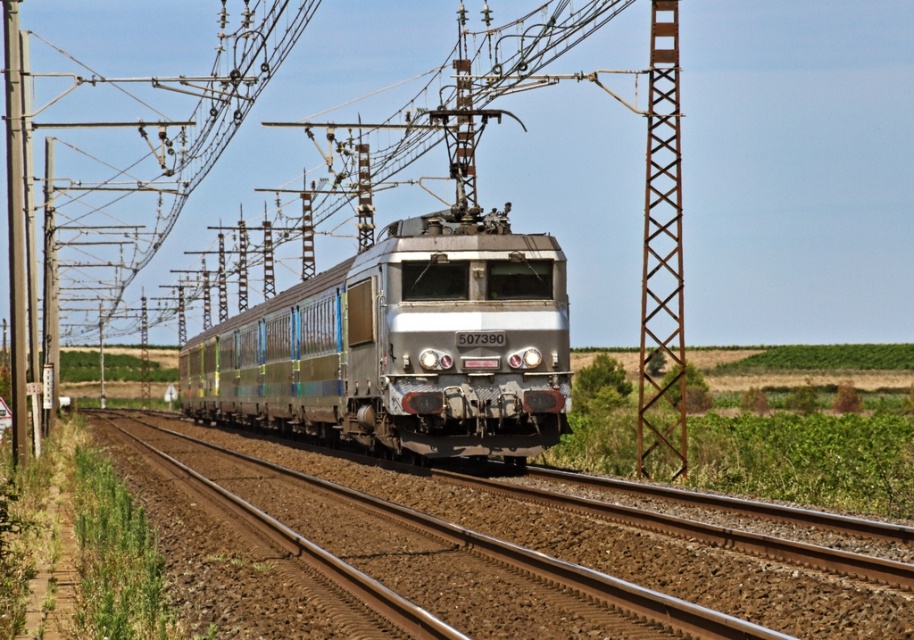
Question: Among these objects, which one is farthest from the camera?

Choices:
 (A) silver metallic train at center
 (B) rusty metal tower at center-right

Answer: (B)

Question: Does silver metallic train at center have a larger size compared to rusty metal tower at center-right?

Choices:
 (A) no
 (B) yes

Answer: (A)

Question: In this image, where is silver metallic train at center located relative to rusty metal tower at center-right?

Choices:
 (A) above
 (B) below

Answer: (B)

Question: Which object appears closest to the camera in this image?

Choices:
 (A) silver metallic train at center
 (B) rusty metal tower at center-right

Answer: (A)

Question: Does silver metallic train at center appear on the right side of rusty metal tower at center-right?

Choices:
 (A) no
 (B) yes

Answer: (A)